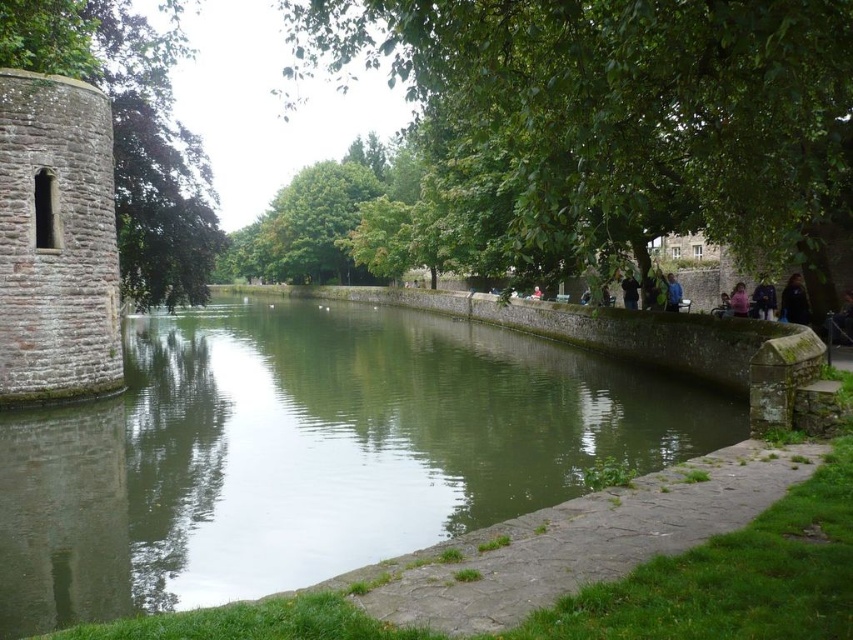
You are a hiker who has just arrived at the riverside. You see a green leafy tree at center and a blue denim jacket at right. Which object is closer to you?

The blue denim jacket at right is closer to you because the green leafy tree at center is positioned over it, indicating it is further away.

Consider the image. You are a bird flying over the riverside scene. You see the green leafy tree at center and the green leafy tree at left. Which tree is positioned lower in the image?

The green leafy tree at center is positioned lower than the green leafy tree at left in the image.

You are a photographer standing at the riverside and want to capture both points in your photo. Which point, point (809, 284) or point (675, 282), will appear larger in the photo due to its position?

Point (809, 284) will appear larger in the photo because it is closer to the camera than point (675, 282).